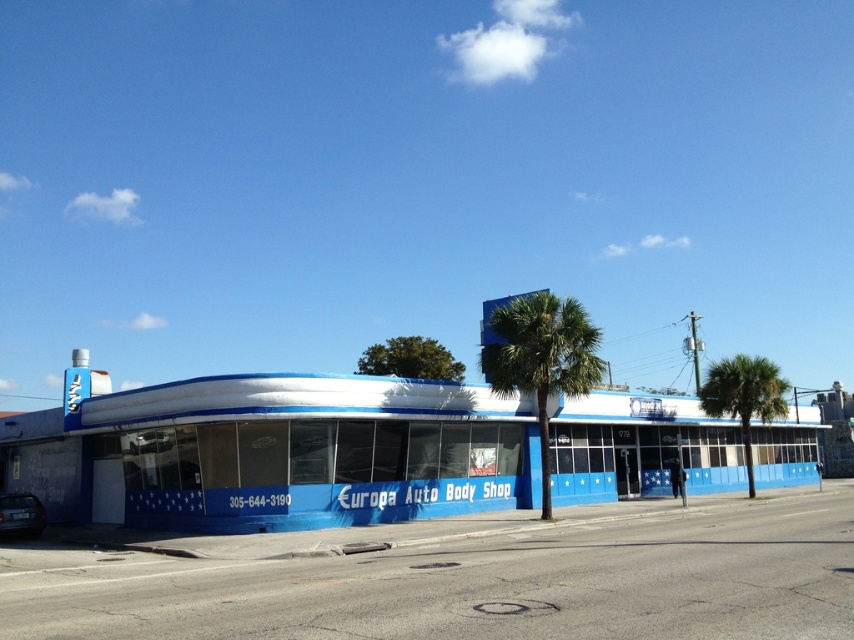
You are standing in front of the Europa Auto Body Shop and want to touch the point at coordinate (541,356). Which object should you reach out to?

The point at coordinate (541,356) is located on the green leafy palm tree at center, so you should reach out to the green leafy palm tree at center.

You are a customer arriving at the Europa Auto Body Shop and see the green leafy palm tree at center and the shiny black car at lower left. Which object is closer to you as you approach the building?

The green leafy palm tree at center is closer to you than the shiny black car at lower left because it is further to the viewer.